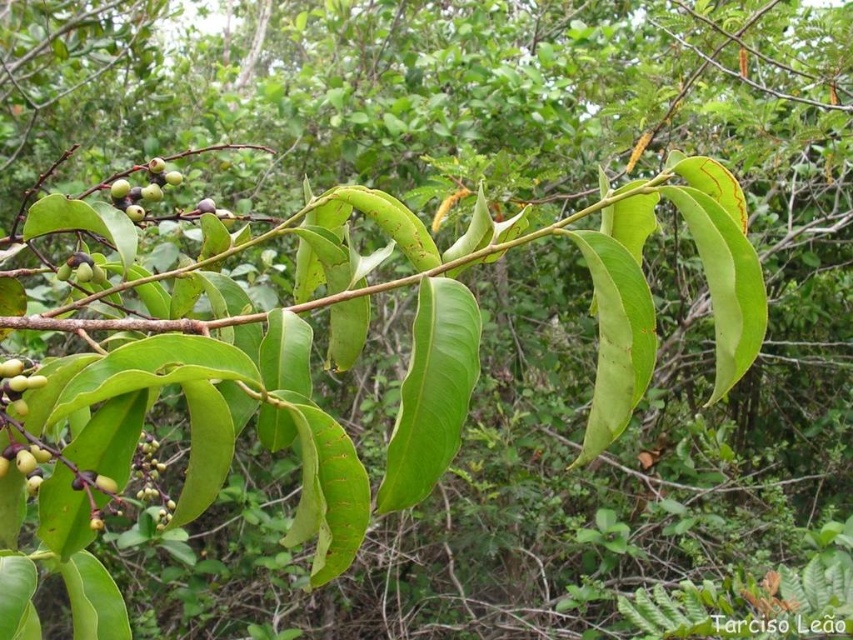
You are standing 1.03 meters away from the point marked at coordinates point (38,376). If you want to take a photo of the berries on the plant branch, will you be able to capture the entire berries in the frame without moving closer?

The point marked at coordinates point (38,376) is 1.03 meters away from the camera. Since the berries are part of the plant branch at that point, you can capture the entire berries in the frame without moving closer, provided the camera has an appropriate lens or zoom capability.

What are the coordinates of the green matte berries at upper left?

The green matte berries at upper left are located at coordinates point [142,189].

You are a gardener who needs to harvest berries and fruit from the plant. The minimum distance required between the berries and fruit to ensure proper growth is 12 inches. Can you confirm if the green matte berries at upper left and green matte fruit at lower left meet this requirement?

The green matte berries at upper left are 12.19 inches from the green matte fruit at lower left, which exceeds the minimum required distance of 12 inches. Therefore, they meet the growth requirement.